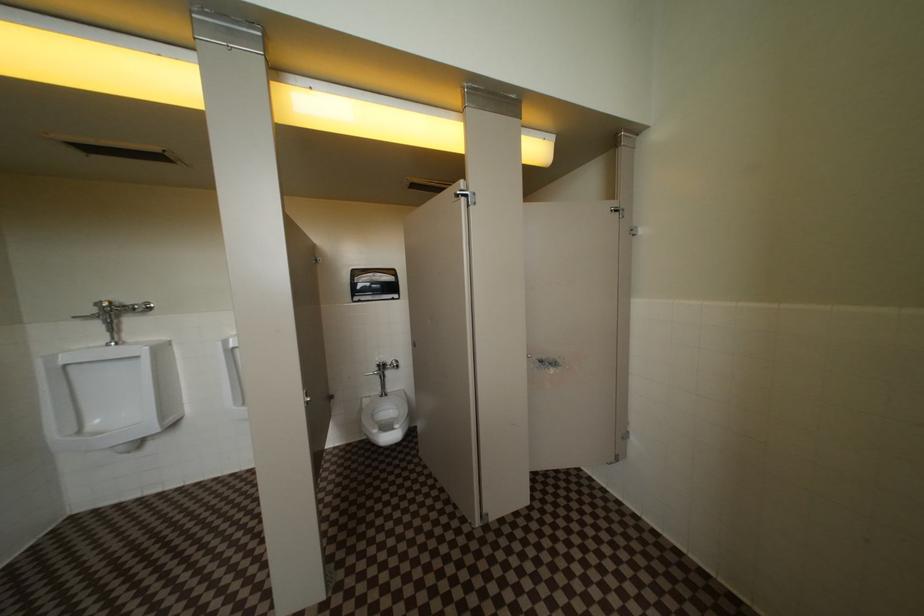
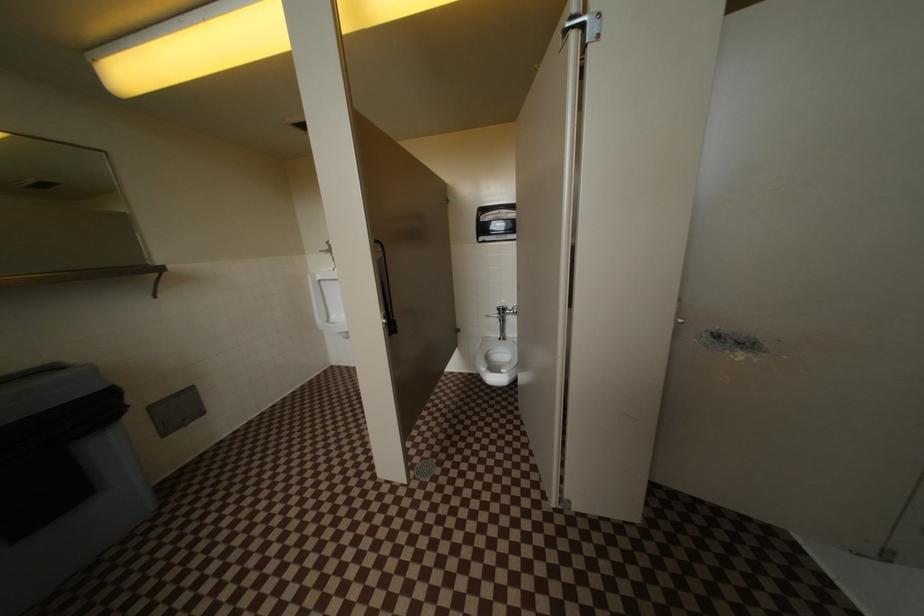
Question: How did the camera likely rotate?

Choices:
 (A) Left
 (B) Right
 (C) Up
 (D) Down

Answer: (A)